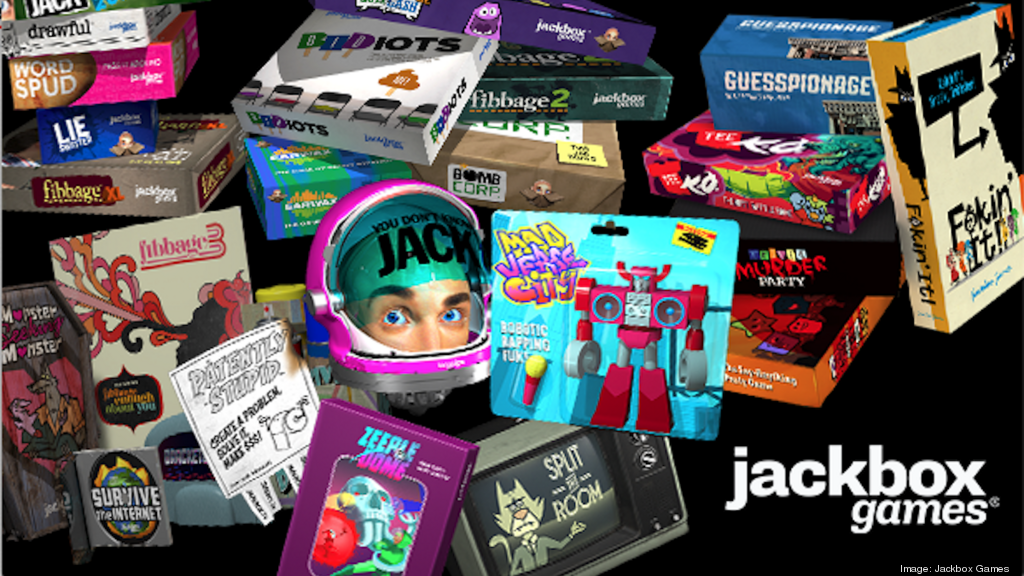
The height and width of the screenshot is (576, 1024). What are the coordinates of `cartoon cat on the television screen` in the screenshot? It's located at (527, 525).